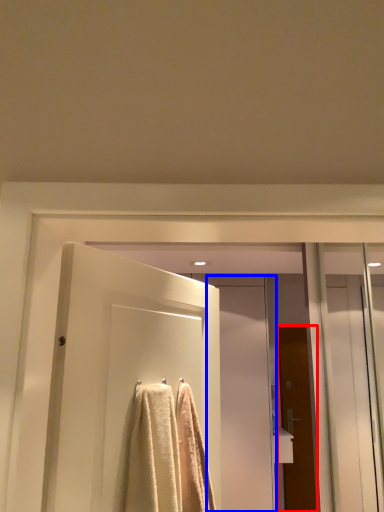
Question: Which object is further to the camera taking this photo, door (highlighted by a red box) or screen door (highlighted by a blue box)?

Choices:
 (A) door
 (B) screen door

Answer: (A)